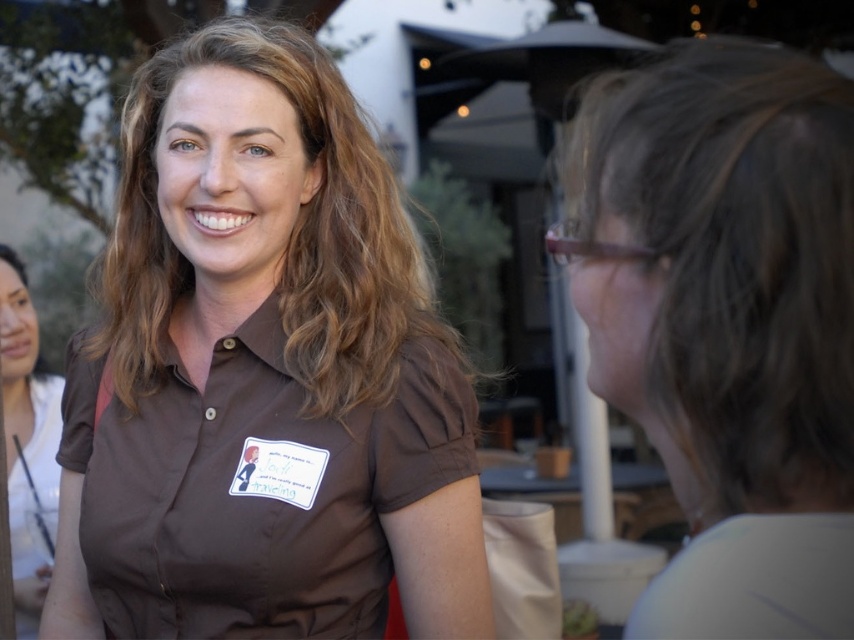
Is brown cotton shirt at center positioned at the back of brown wavy hair at center?

No.

Is brown cotton shirt at center in front of brown wavy hair at center?

Yes, it is in front of brown wavy hair at center.

Identify the location of brown cotton shirt at center. (255, 488).

Does gray matte hair at right have a lesser height compared to brown cotton shirt at center?

Correct, gray matte hair at right is not as tall as brown cotton shirt at center.

Who is higher up, gray matte hair at right or brown cotton shirt at center?

gray matte hair at right is above.

Identify the location of gray matte hair at right. This screenshot has height=640, width=854. (722, 269).

Between brown wavy hair at center and matte brown shirt at left, which one appears on the left side from the viewer's perspective?

Positioned to the left is matte brown shirt at left.

Is brown wavy hair at center shorter than matte brown shirt at left?

Yes.

Between point (151, 177) and point (9, 384), which one is positioned behind?

Positioned behind is point (9, 384).

What are the coordinates of `brown wavy hair at center` in the screenshot? It's located at (288, 240).